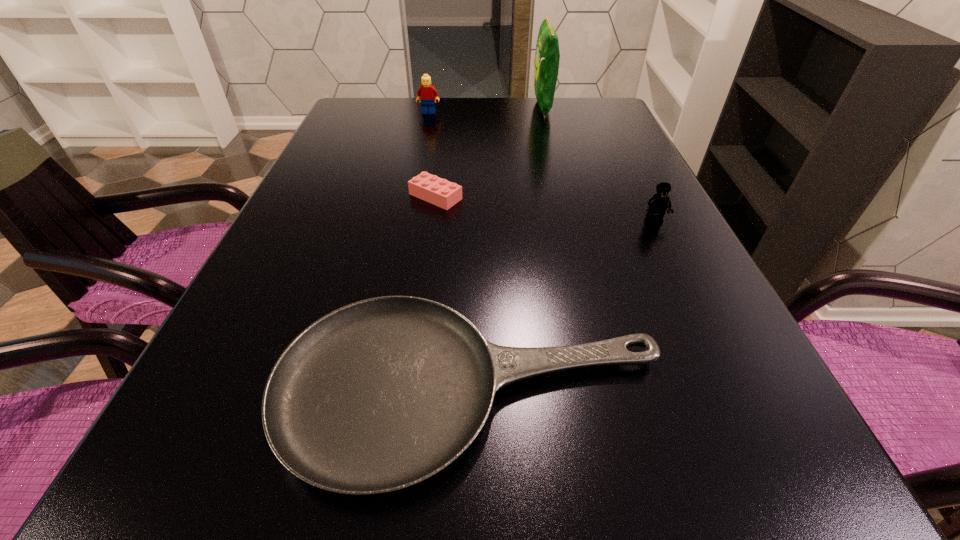
Identify which object is located as the second nearest to the third nearest object. Please provide its 2D coordinates. Your answer should be formatted as a tuple, i.e. [(x, y)], where the tuple contains the x and y coordinates of a point satisfying the conditions above.

[(657, 205)]

Select which object appears as the second closest to the frying pan. Please provide its 2D coordinates. Your answer should be formatted as a tuple, i.e. [(x, y)], where the tuple contains the x and y coordinates of a point satisfying the conditions above.

[(430, 188)]

Locate which Lego ranks in proximity to the third tallest object. Please provide its 2D coordinates. Your answer should be formatted as a tuple, i.e. [(x, y)], where the tuple contains the x and y coordinates of a point satisfying the conditions above.

[(430, 188)]

Where is `Lego that is the closest one to the frying pan`? Lego that is the closest one to the frying pan is located at coordinates (657, 205).

Identify the location of free space that satisfies the following two spatial constraints: 1. on the front-facing side of the tallest object; 2. on the front-facing side of the farthest Lego. point(544,112).